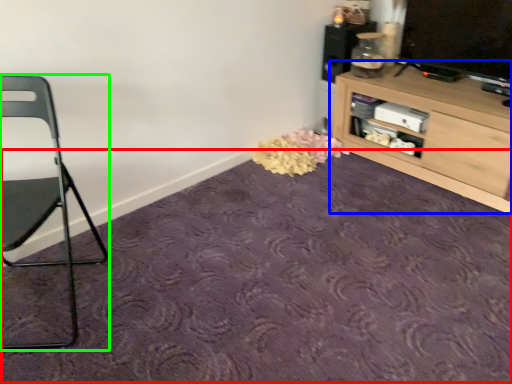
Question: Which is farther away from plain (highlighted by a red box)? shelf (highlighted by a blue box) or chair (highlighted by a green box)?

Choices:
 (A) shelf
 (B) chair

Answer: (A)